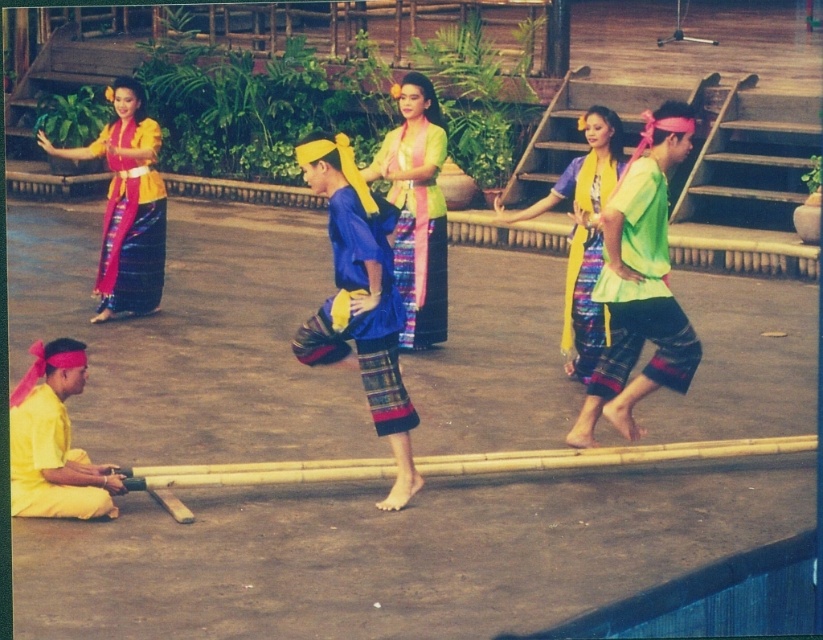
You are a photographer trying to capture the cultural performance. You notice the blue woven skirt at center and the matte yellow shirt at lower left. Which object should you focus on if you want to photograph the larger one?

The blue woven skirt at center is larger in size than the matte yellow shirt at lower left, so you should focus on the blue woven skirt at center to photograph the larger one.

You are a photographer positioned at the front of the stage. You notice the blue woven skirt at center and the matte yellow fabric at upper left in your viewfinder. Which object is positioned lower in the image?

The blue woven skirt at center is located below the matte yellow fabric at upper left, so it is positioned lower in the image.

You are a photographer standing at the front of the stage. You want to capture a closeup of the blue woven skirt at center. Where should you position your camera to get the best shot?

The blue woven skirt at center is located at point (361,312), so position the camera directly facing that coordinate for the best closeup shot.